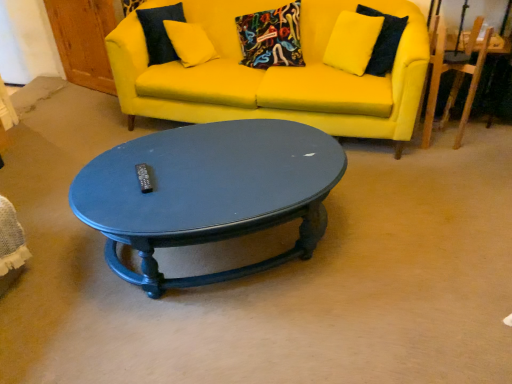
Question: Is glossy dark blue coffee table at center to the right of matte yellow fabric couch at upper center from the viewer's perspective?

Choices:
 (A) yes
 (B) no

Answer: (B)

Question: Is glossy dark blue coffee table at center oriented towards matte yellow fabric couch at upper center?

Choices:
 (A) no
 (B) yes

Answer: (A)

Question: Is glossy dark blue coffee table at center thinner than matte yellow fabric couch at upper center?

Choices:
 (A) yes
 (B) no

Answer: (A)

Question: From the image's perspective, is glossy dark blue coffee table at center below matte yellow fabric couch at upper center?

Choices:
 (A) yes
 (B) no

Answer: (A)

Question: Considering the relative sizes of glossy dark blue coffee table at center and matte yellow fabric couch at upper center in the image provided, is glossy dark blue coffee table at center smaller than matte yellow fabric couch at upper center?

Choices:
 (A) no
 (B) yes

Answer: (B)

Question: Is glossy dark blue coffee table at center further to the viewer compared to matte yellow fabric couch at upper center?

Choices:
 (A) yes
 (B) no

Answer: (B)

Question: Does wooden armchair at right have a greater width compared to matte yellow fabric couch at upper center?

Choices:
 (A) no
 (B) yes

Answer: (A)

Question: From a real-world perspective, does wooden armchair at right stand above matte yellow fabric couch at upper center?

Choices:
 (A) yes
 (B) no

Answer: (A)

Question: Is the depth of wooden armchair at right less than that of matte yellow fabric couch at upper center?

Choices:
 (A) yes
 (B) no

Answer: (B)

Question: Does wooden armchair at right have a smaller size compared to matte yellow fabric couch at upper center?

Choices:
 (A) yes
 (B) no

Answer: (A)

Question: Is wooden armchair at right positioned far away from matte yellow fabric couch at upper center?

Choices:
 (A) yes
 (B) no

Answer: (B)

Question: Does wooden armchair at right have a lesser width compared to matte yellow fabric couch at upper center?

Choices:
 (A) yes
 (B) no

Answer: (A)

Question: Is matte yellow fabric couch at upper center taller than wooden armchair at right?

Choices:
 (A) yes
 (B) no

Answer: (A)